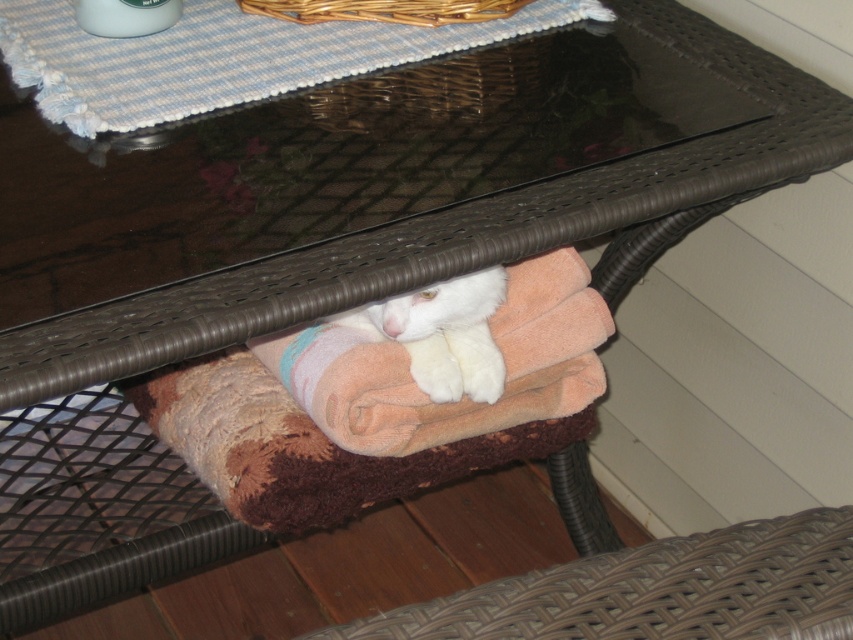
Question: Considering the relative positions of white fluffy cat under the table and woven wicker basket at upper center in the image provided, where is white fluffy cat under the table located with respect to woven wicker basket at upper center?

Choices:
 (A) below
 (B) above

Answer: (A)

Question: Among these objects, which one is nearest to the camera?

Choices:
 (A) blue woven placemat at upper center
 (B) soft pink towel at under table

Answer: (A)

Question: Which object is positioned closest to the white fluffy cat under the table?

Choices:
 (A) blue woven placemat at upper center
 (B) soft pink towel at under table

Answer: (B)

Question: Does blue woven placemat at upper center have a larger size compared to white fluffy cat under the table?

Choices:
 (A) no
 (B) yes

Answer: (B)

Question: Does blue woven placemat at upper center appear on the right side of soft pink towel at under table?

Choices:
 (A) no
 (B) yes

Answer: (A)

Question: Which object is closer to the camera taking this photo?

Choices:
 (A) blue woven placemat at upper center
 (B) soft pink towel at under table
 (C) woven wicker basket at upper center
 (D) white fluffy cat under the table

Answer: (A)